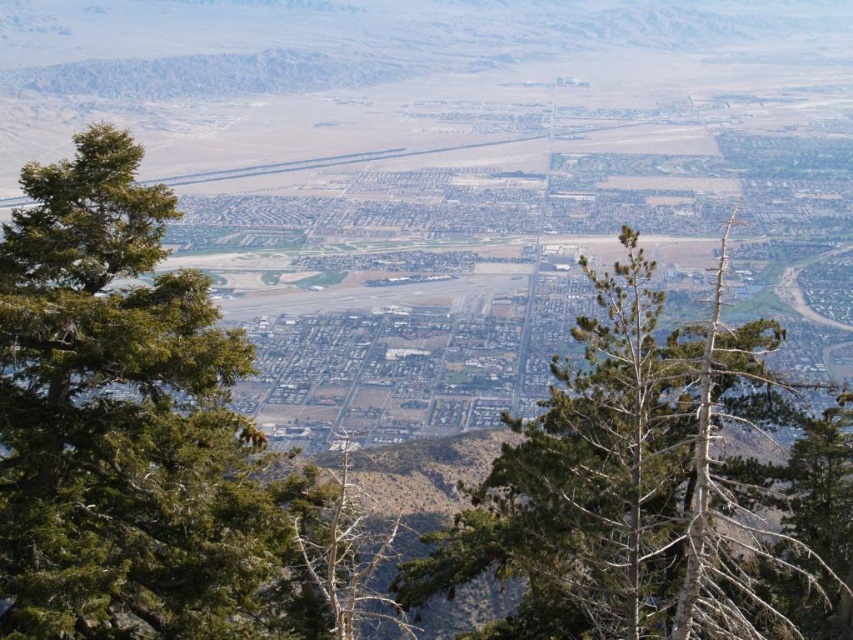
You are a drone operator tasked with capturing aerial footage. Your drone is currently hovering above the green leafy tree at center. You need to fly it to the nearest building in the middle ground. How far will the drone have to travel?

The green leafy tree at center is 103.82 meters away from the nearest building in the middle ground. Therefore, the drone will need to travel 103.82 meters to reach the nearest building.

Looking at this image, you are a city planner analyzing the urban landscape. You observe the green leafy tree at center and the bare wood tree at center. Which tree has a larger canopy width according to the scene description?

The green leafy tree at center might be wider than the bare wood tree at center, so the green leafy tree at center has a larger canopy width.